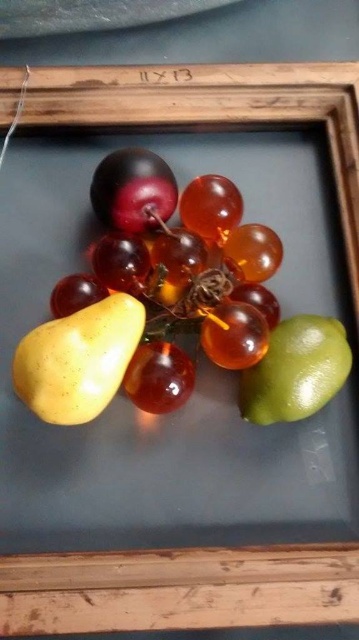
Question: Which of these objects is positioned farthest from the green matte lime at lower right?

Choices:
 (A) translucent amber grapes at center
 (B) yellow matte pear at center-left

Answer: (B)

Question: Does translucent amber grapes at center appear on the right side of yellow matte pear at center-left?

Choices:
 (A) no
 (B) yes

Answer: (B)

Question: Is translucent amber grapes at center positioned in front of yellow matte pear at center-left?

Choices:
 (A) no
 (B) yes

Answer: (A)

Question: Is the position of translucent amber grapes at center less distant than that of green matte lime at lower right?

Choices:
 (A) yes
 (B) no

Answer: (B)

Question: Which point appears closest to the camera in this image?

Choices:
 (A) (89, 412)
 (B) (325, 401)
 (C) (104, 250)

Answer: (A)

Question: Among these objects, which one is farthest from the camera?

Choices:
 (A) green matte lime at lower right
 (B) yellow matte pear at center-left

Answer: (A)